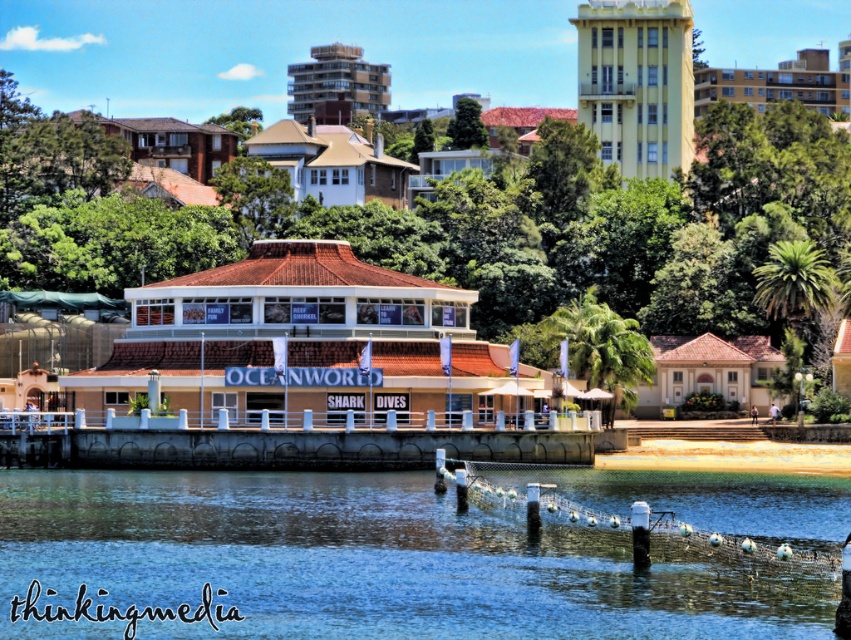
Between beige textured building at center and beige concrete building at upper right, which one has less height?

Standing shorter between the two is beige textured building at center.

Measure the distance between beige textured building at center and camera.

beige textured building at center and camera are 103.22 meters apart.

Find the location of a particular element. The image size is (851, 640). beige textured building at center is located at coordinates (300, 339).

Which is in front, point (457, 316) or point (304, 172)?

Point (457, 316)

Is point (133, 369) positioned behind point (286, 170)?

No, it is in front of (286, 170).

Where is `beige textured building at center`? The image size is (851, 640). beige textured building at center is located at coordinates (300, 339).

Can you confirm if beige textured building at center is taller than white concrete dock at center?

Correct, beige textured building at center is much taller as white concrete dock at center.

The height and width of the screenshot is (640, 851). Describe the element at coordinates (300, 339) in the screenshot. I see `beige textured building at center` at that location.

From the picture: Who is more forward, (254, 417) or (541, 433)?

Point (254, 417) is more forward.

Locate an element on the screen. This screenshot has height=640, width=851. beige textured building at center is located at coordinates (300, 339).